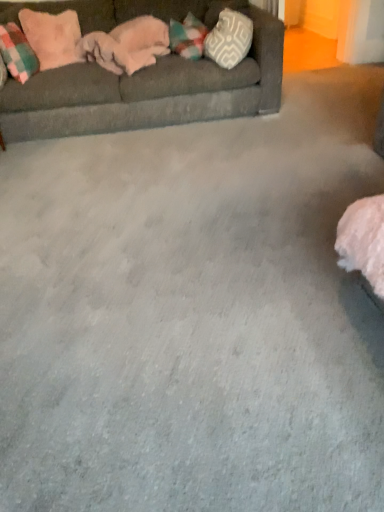
Question: Can you confirm if pink plush pillow at upper left, the 2th pillow when ordered from right to left, is thinner than white textured pillow at upper right, which is the first pillow in right-to-left order?

Choices:
 (A) no
 (B) yes

Answer: (B)

Question: Does pink plush pillow at upper left, which ranks as the 2th pillow in left-to-right order, contain white textured pillow at upper right, which is the first pillow in right-to-left order?

Choices:
 (A) no
 (B) yes

Answer: (A)

Question: Is pink plush pillow at upper left, the 2th pillow when ordered from right to left, turned away from white textured pillow at upper right, placed as the third pillow when sorted from left to right?

Choices:
 (A) yes
 (B) no

Answer: (B)

Question: Is pink plush pillow at upper left, the 2th pillow when ordered from right to left, shorter than white textured pillow at upper right, which is the first pillow in right-to-left order?

Choices:
 (A) no
 (B) yes

Answer: (A)

Question: Is pink plush pillow at upper left, which ranks as the 2th pillow in left-to-right order, in front of white textured pillow at upper right, placed as the third pillow when sorted from left to right?

Choices:
 (A) yes
 (B) no

Answer: (B)

Question: Can you confirm if pink plush pillow at upper left, which ranks as the 2th pillow in left-to-right order, is taller than white textured pillow at upper right, placed as the third pillow when sorted from left to right?

Choices:
 (A) yes
 (B) no

Answer: (A)

Question: From the image's perspective, would you say dark gray fabric couch at upper left is shown under pink plush pillow at upper left, the 2th pillow when ordered from right to left?

Choices:
 (A) no
 (B) yes

Answer: (B)

Question: Is dark gray fabric couch at upper left closer to the viewer compared to pink plush pillow at upper left, the 2th pillow when ordered from right to left?

Choices:
 (A) yes
 (B) no

Answer: (A)

Question: Is dark gray fabric couch at upper left oriented towards pink plush pillow at upper left, the 2th pillow when ordered from right to left?

Choices:
 (A) yes
 (B) no

Answer: (A)

Question: From the image's perspective, is dark gray fabric couch at upper left on top of pink plush pillow at upper left, the 2th pillow when ordered from right to left?

Choices:
 (A) yes
 (B) no

Answer: (B)

Question: Does dark gray fabric couch at upper left have a greater height compared to pink plush pillow at upper left, which ranks as the 2th pillow in left-to-right order?

Choices:
 (A) no
 (B) yes

Answer: (B)

Question: From a real-world perspective, is dark gray fabric couch at upper left over pink plush pillow at upper left, the 2th pillow when ordered from right to left?

Choices:
 (A) yes
 (B) no

Answer: (B)

Question: Does white textured pillow at upper right, placed as the third pillow when sorted from left to right, lie in front of pink plush pillow at upper left, which ranks as the 2th pillow in left-to-right order?

Choices:
 (A) no
 (B) yes

Answer: (B)